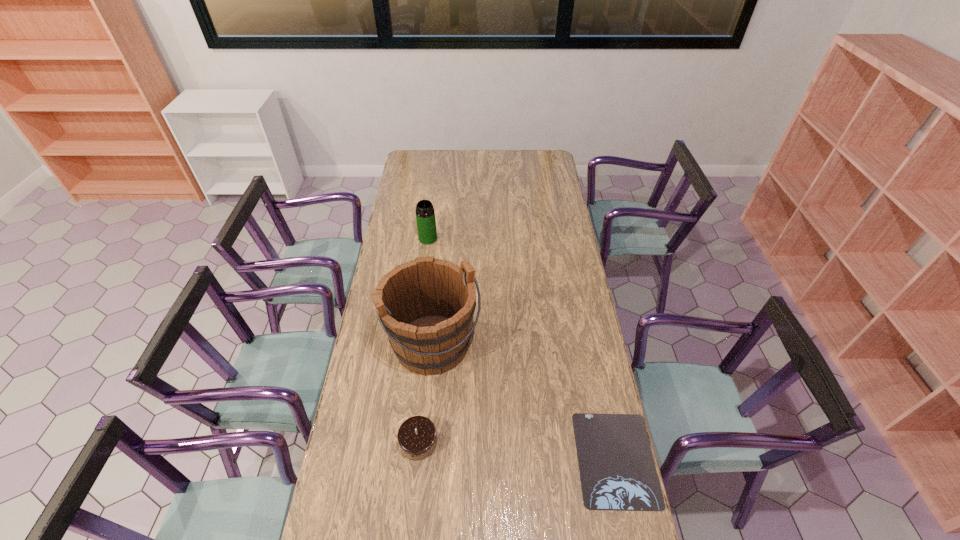
Where is `free space located 0.350m from the spout of the thermos bottle`? Image resolution: width=960 pixels, height=540 pixels. free space located 0.350m from the spout of the thermos bottle is located at coordinates (445, 296).

What are the coordinates of `vacant space situated from the spout of the thermos bottle` in the screenshot? It's located at pos(439,275).

Where is `free space located 0.220m on the side of the third nearest object with the handle for carrying`? The height and width of the screenshot is (540, 960). free space located 0.220m on the side of the third nearest object with the handle for carrying is located at coordinates (482, 427).

This screenshot has height=540, width=960. I want to click on vacant point located on the side of the third nearest object with the handle for carrying, so (477, 417).

Locate an element on the screen. The height and width of the screenshot is (540, 960). free location located on the side of the third nearest object with the handle for carrying is located at coordinates click(477, 417).

At what (x,y) coordinates should I click in order to perform the action: click on object that is positioned at the near edge. Please return your answer as a coordinate pair (x, y). Looking at the image, I should click on (617, 471).

I want to click on thermos bottle that is at the left edge, so click(425, 215).

This screenshot has height=540, width=960. What are the coordinates of `wine bucket that is positioned at the left edge` in the screenshot? It's located at (426, 306).

Where is `object at the right edge`? object at the right edge is located at coordinates pyautogui.click(x=617, y=471).

What are the coordinates of `object located at the near right corner` in the screenshot? It's located at (617, 471).